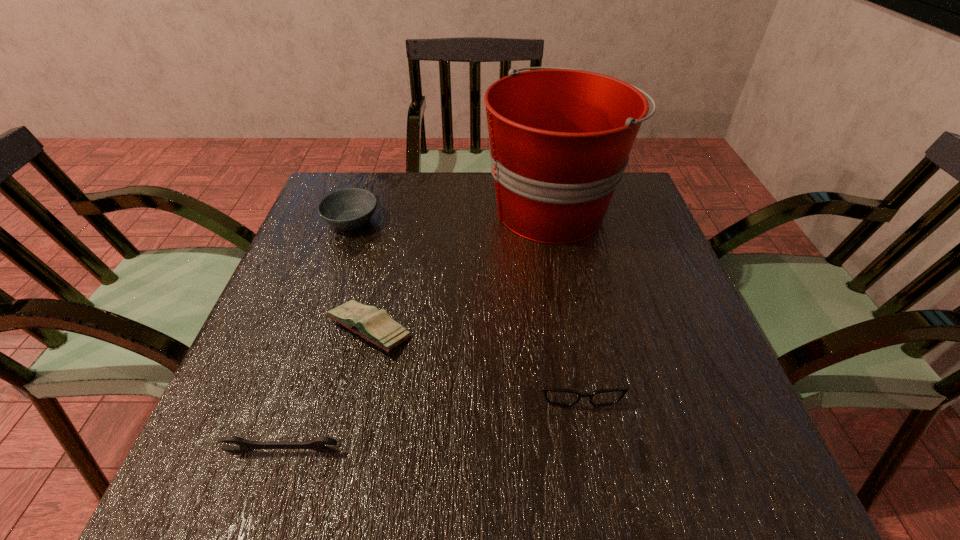
I want to click on soup bowl positioned at the far edge, so click(351, 208).

Locate an element on the screen. The image size is (960, 540). object that is at the near edge is located at coordinates (317, 443).

The width and height of the screenshot is (960, 540). In order to click on soup bowl positioned at the left edge in this screenshot , I will do `click(351, 208)`.

Find the location of `diary that is positioned at the left edge`. diary that is positioned at the left edge is located at coordinates (376, 326).

You are a GUI agent. You are given a task and a screenshot of the screen. Output one action in this format:
    pyautogui.click(x=<x>, y=<y>)
    Task: Click on the wrench at the left edge
    This screenshot has height=540, width=960.
    Given the screenshot: What is the action you would take?
    pyautogui.click(x=317, y=443)

Locate an element on the screen. object that is positioned at the right edge is located at coordinates (560, 139).

Where is `object that is at the far left corner`? object that is at the far left corner is located at coordinates (351, 208).

You are a GUI agent. You are given a task and a screenshot of the screen. Output one action in this format:
    pyautogui.click(x=<x>, y=<y>)
    Task: Click on the object situated at the near left corner
    This screenshot has width=960, height=540.
    Given the screenshot: What is the action you would take?
    pyautogui.click(x=317, y=443)

I want to click on object that is at the far right corner, so pos(560,139).

Image resolution: width=960 pixels, height=540 pixels. In order to click on vacant region at the far edge of the desktop in this screenshot , I will do `click(385, 174)`.